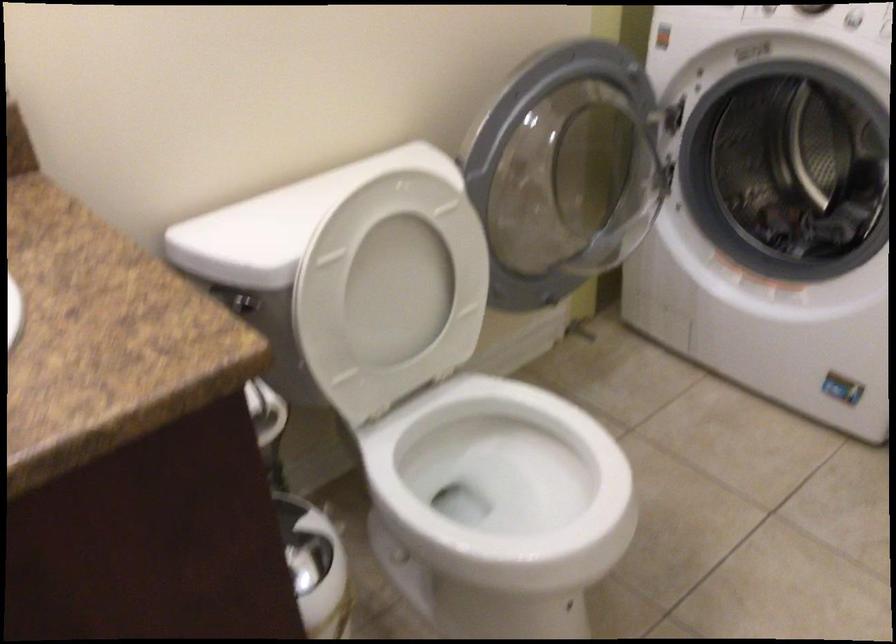
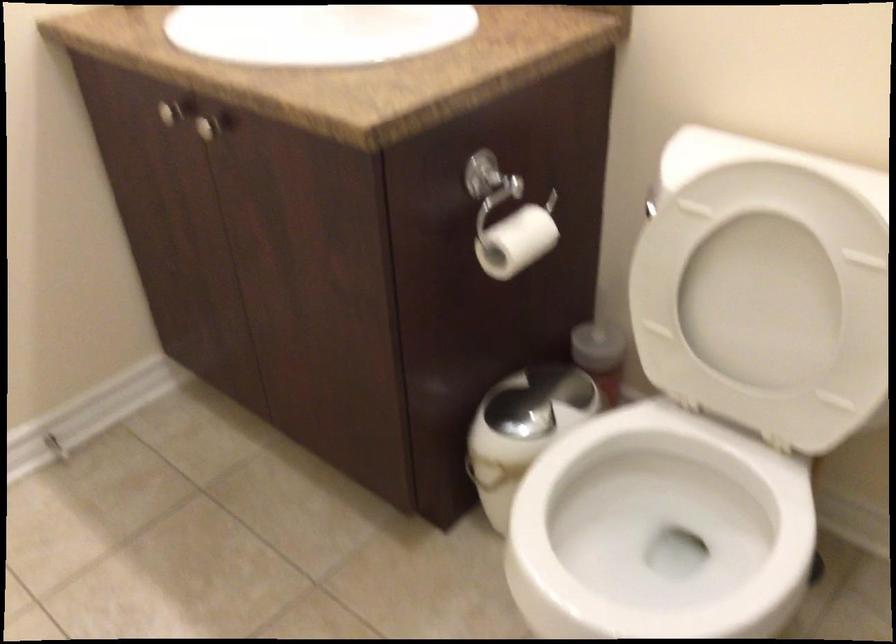
Find the pixel in the second image that matches (x=389, y=290) in the first image.

(763, 299)